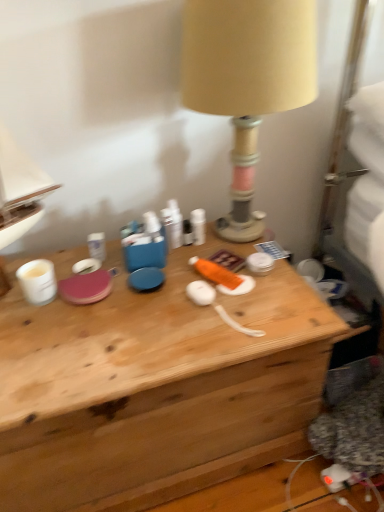
Question: Does wooden desk at center have a smaller size compared to beige fabric lampshade at upper center?

Choices:
 (A) no
 (B) yes

Answer: (A)

Question: Is wooden desk at center turned away from beige fabric lampshade at upper center?

Choices:
 (A) no
 (B) yes

Answer: (A)

Question: From the image's perspective, is wooden desk at center over beige fabric lampshade at upper center?

Choices:
 (A) yes
 (B) no

Answer: (B)

Question: Does wooden desk at center turn towards beige fabric lampshade at upper center?

Choices:
 (A) yes
 (B) no

Answer: (B)

Question: Can you confirm if wooden desk at center is thinner than beige fabric lampshade at upper center?

Choices:
 (A) yes
 (B) no

Answer: (B)

Question: Would you consider wooden desk at center to be distant from beige fabric lampshade at upper center?

Choices:
 (A) yes
 (B) no

Answer: (B)

Question: Is beige fabric lampshade at upper center to the left of wooden desk at center from the viewer's perspective?

Choices:
 (A) no
 (B) yes

Answer: (A)

Question: From the image's perspective, is beige fabric lampshade at upper center beneath wooden desk at center?

Choices:
 (A) no
 (B) yes

Answer: (A)

Question: Is beige fabric lampshade at upper center positioned in front of wooden desk at center?

Choices:
 (A) no
 (B) yes

Answer: (A)

Question: Is beige fabric lampshade at upper center aimed at wooden desk at center?

Choices:
 (A) yes
 (B) no

Answer: (B)

Question: From the image's perspective, would you say beige fabric lampshade at upper center is positioned over wooden desk at center?

Choices:
 (A) no
 (B) yes

Answer: (B)

Question: Can you confirm if beige fabric lampshade at upper center is taller than wooden desk at center?

Choices:
 (A) yes
 (B) no

Answer: (A)

Question: Considering their positions, is beige fabric lampshade at upper center located in front of or behind wooden desk at center?

Choices:
 (A) behind
 (B) front

Answer: (A)